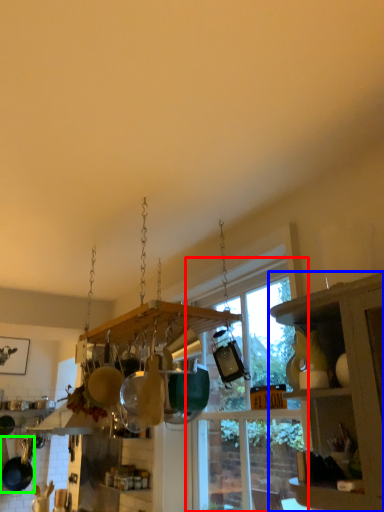
Question: Considering the real-world distances, which object is farthest from window (highlighted by a red box)? cabinetry (highlighted by a blue box) or frying pan (highlighted by a green box)?

Choices:
 (A) cabinetry
 (B) frying pan

Answer: (B)